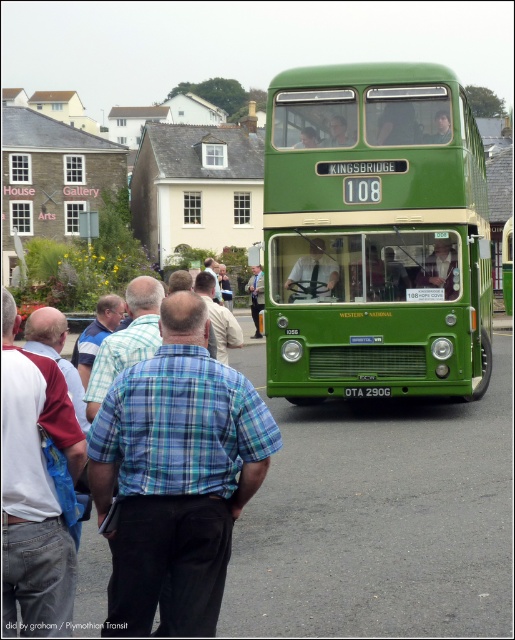
Question: Which of the following is the closest to the observer?

Choices:
 (A) green matte/deck bus at center
 (B) blue plaid shirt at center

Answer: (B)

Question: Which of the following is the closest to the observer?

Choices:
 (A) blue plaid shirt at center
 (B) green matte bus at center
 (C) blackmetalliclicense plate at lower center
 (D) green matte/deck bus at center

Answer: (A)

Question: Does green matte/deck bus at center have a greater width compared to blackmetalliclicense plate at lower center?

Choices:
 (A) yes
 (B) no

Answer: (A)

Question: Does blue plaid shirt at center have a larger size compared to green matte bus at center?

Choices:
 (A) no
 (B) yes

Answer: (A)

Question: Is green matte/deck bus at center above green matte bus at center?

Choices:
 (A) yes
 (B) no

Answer: (B)

Question: Estimate the real-world distances between objects in this image. Which object is farther from the blue plaid shirt at center?

Choices:
 (A) green matte/deck bus at center
 (B) blackmetalliclicense plate at lower center
 (C) green matte bus at center

Answer: (C)